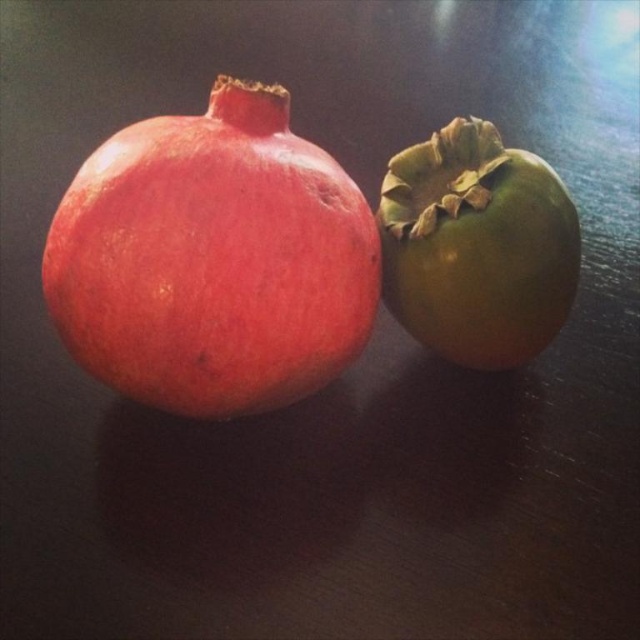
You are a fruit seller arranging fruits on a shelf. You have a shiny red pomegranate at left and a green persimmon at right. You want to place a decorative bowl at point (x=212, y=259). Will placing the bowl there cover the shiny red pomegranate at left?

The point (x=212, y=259) is where the shiny red pomegranate at left is located, so placing the bowl there would cover it.

You are standing in front of the image and want to pick up the shiny red pomegranate at left and the green matte persimmon at right. Which fruit do you need to reach forward more to pick up?

You need to reach forward more to pick up the green matte persimmon at right because it is farther from the viewer compared to the shiny red pomegranate at left.

You are looking at the image and want to determine which of the two points, point (122,250) or point (460,305), is closer to you. Based on the description, which point is nearer?

Point (122,250) is closer to the camera than point (460,305), so it is the nearer point.